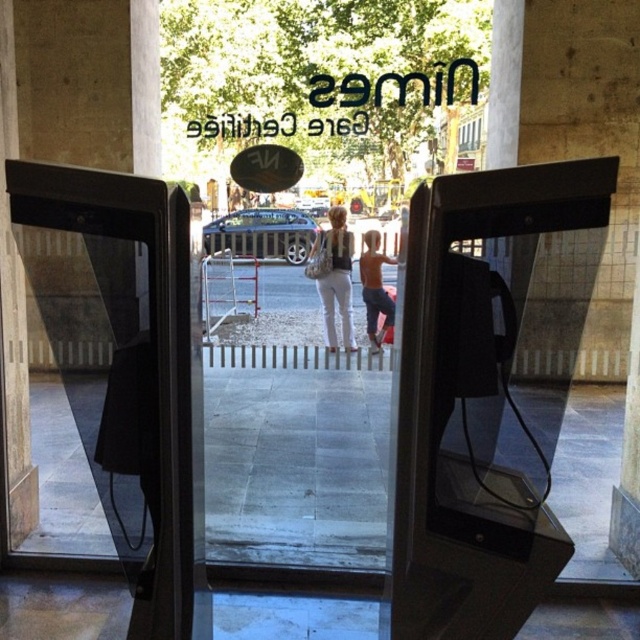
Question: Estimate the real-world distances between objects in this image. Which object is farther from the black plastic payphone at center?

Choices:
 (A) shiny metallic shorts at center
 (B) white cotton pants at center

Answer: (B)

Question: Is black plastic payphone at center to the right of shiny metallic shorts at center from the viewer's perspective?

Choices:
 (A) no
 (B) yes

Answer: (A)

Question: Estimate the real-world distances between objects in this image. Which object is farther from the white cotton pants at center?

Choices:
 (A) black plastic payphone at center
 (B) shiny metallic shorts at center

Answer: (A)

Question: Is white cotton pants at center further to camera compared to shiny metallic shorts at center?

Choices:
 (A) no
 (B) yes

Answer: (B)

Question: Which of the following is the farthest from the observer?

Choices:
 (A) shiny metallic shorts at center
 (B) black plastic payphone at center

Answer: (A)

Question: Is black plastic payphone at center to the right of shiny metallic shorts at center from the viewer's perspective?

Choices:
 (A) no
 (B) yes

Answer: (A)